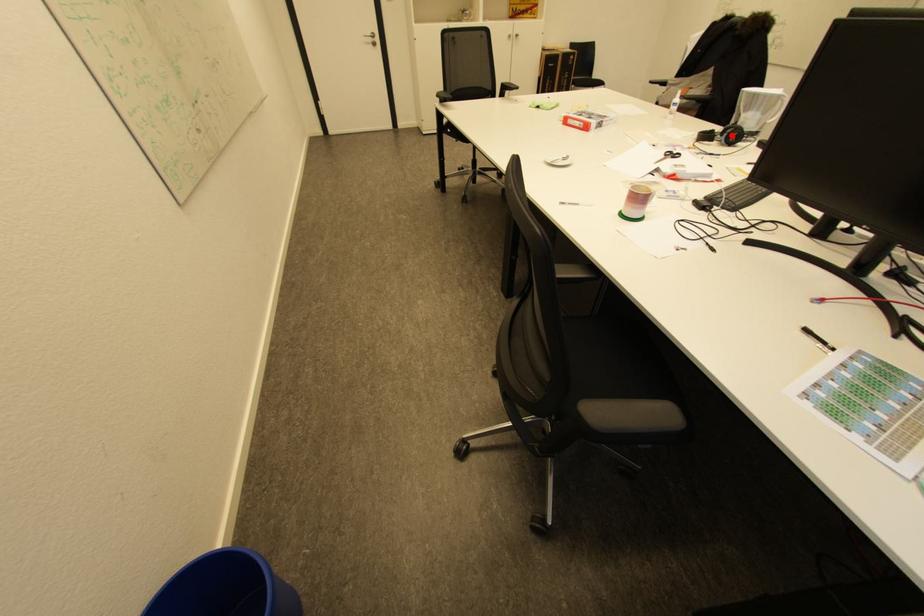
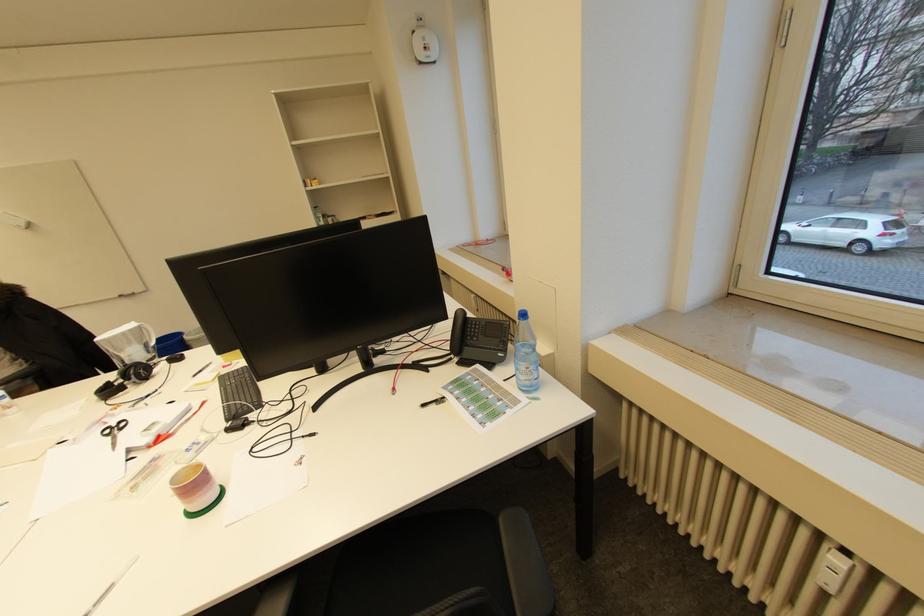
Question: I am providing you with two images of the same scene from different viewpoints. A red point is marked on the first image. Can you still see the location of the red point in image 2?

Choices:
 (A) Yes
 (B) No

Answer: (A)